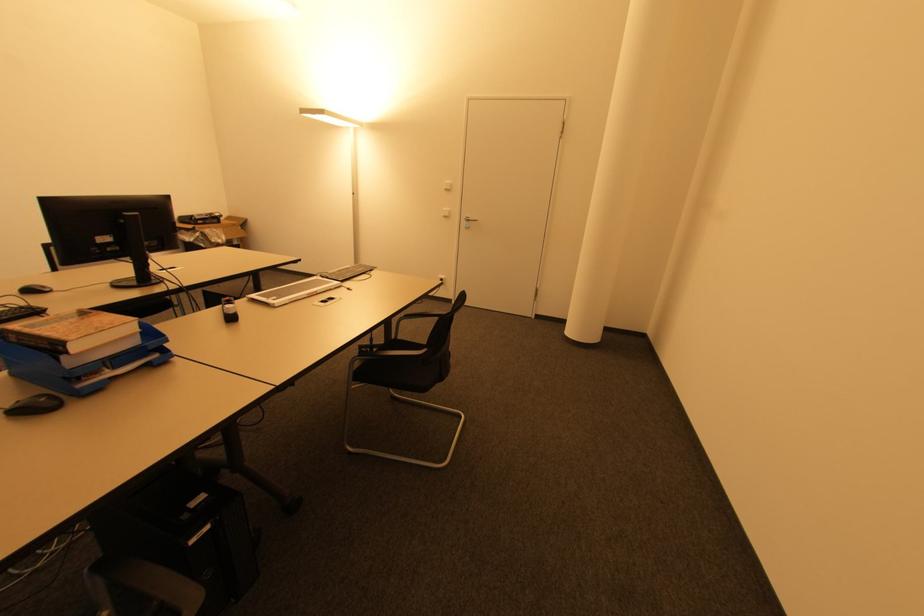
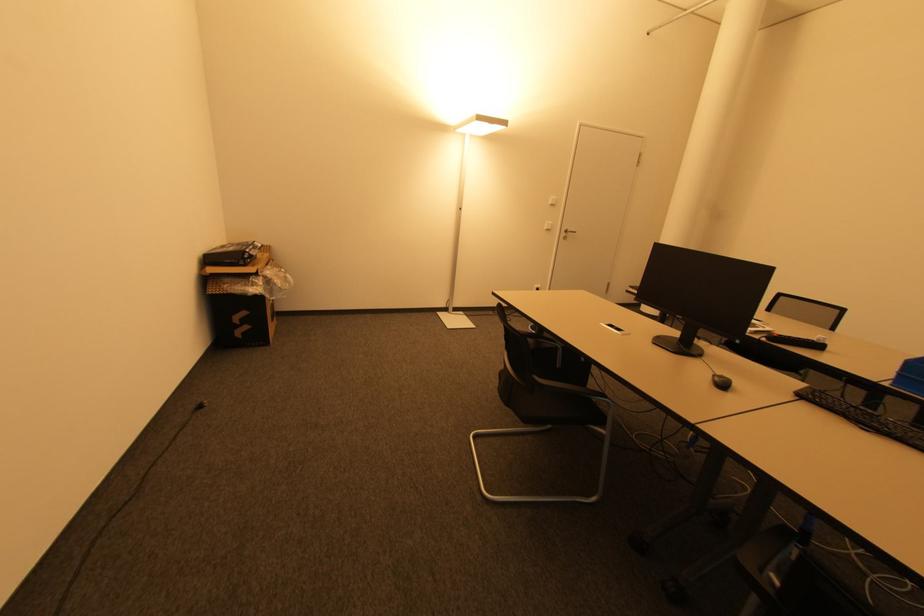
Find the pixel in the second image that matches the point at 466,223 in the first image.

(565, 235)